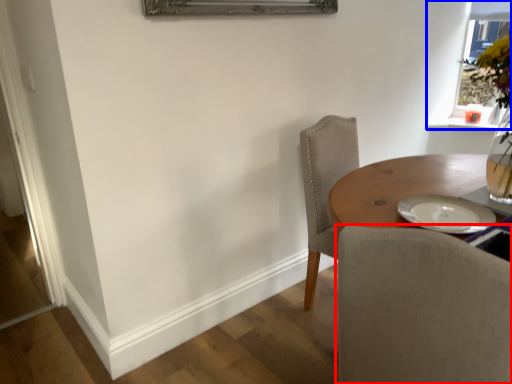
Question: Among these objects, which one is nearest to the camera, chair (highlighted by a red box) or window (highlighted by a blue box)?

Choices:
 (A) chair
 (B) window

Answer: (A)